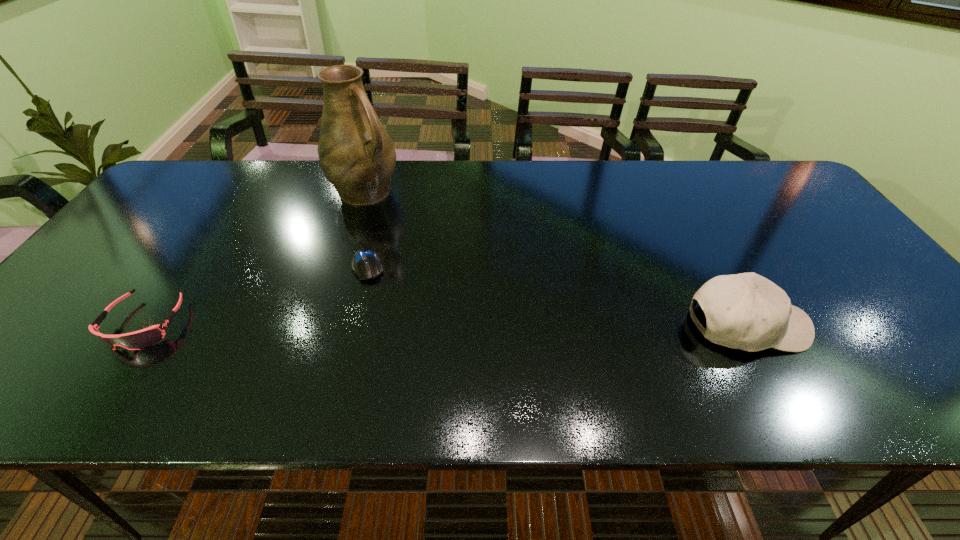
In the image, there is a desktop. Identify the location of vacant space at the far edge. (640, 195).

Image resolution: width=960 pixels, height=540 pixels. Identify the location of vacant space at the near edge. (549, 349).

Locate an element on the screen. free space at the left edge is located at coordinates (87, 309).

This screenshot has width=960, height=540. I want to click on vacant space at the far right corner of the desktop, so click(x=750, y=194).

At what (x,y) coordinates should I click in order to perform the action: click on vacant region between the third tallest object and the baseball cap. Please return your answer as a coordinate pair (x, y). The width and height of the screenshot is (960, 540). Looking at the image, I should click on pos(446,324).

The height and width of the screenshot is (540, 960). Identify the location of free space that is in between the farthest object and the computer mouse. [367, 228].

Find the location of a particular element. The height and width of the screenshot is (540, 960). free space between the shortest object and the goggles is located at coordinates (256, 295).

Where is `free space between the second tallest object and the farthest object`? The height and width of the screenshot is (540, 960). free space between the second tallest object and the farthest object is located at coordinates (556, 258).

Locate an element on the screen. The image size is (960, 540). free space between the leftmost object and the third shortest object is located at coordinates (446, 324).

Find the location of a particular element. The width and height of the screenshot is (960, 540). free area in between the third tallest object and the rightmost object is located at coordinates (446, 324).